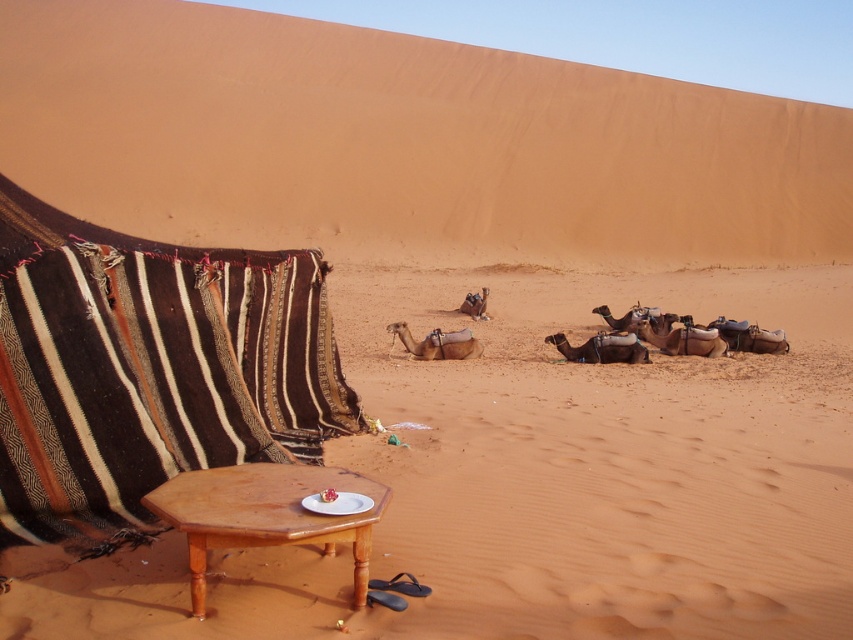
Question: Among these objects, which one is nearest to the camera?

Choices:
 (A) sandy yellow sand at center
 (B) brown wooden table at lower center
 (C) brown striped fabric at left

Answer: (B)

Question: Can you confirm if sandy yellow sand at center is positioned above brown striped fabric at left?

Choices:
 (A) no
 (B) yes

Answer: (A)

Question: Is sandy yellow sand at center positioned in front of brown wooden table at lower center?

Choices:
 (A) yes
 (B) no

Answer: (B)

Question: Does sandy yellow sand at center come in front of brown striped fabric at left?

Choices:
 (A) yes
 (B) no

Answer: (A)

Question: Which object is positioned farthest from the sandy yellow sand at center?

Choices:
 (A) brown striped fabric at left
 (B) brown wooden table at lower center
 (C) smooth sand dune at upper left

Answer: (C)

Question: Which object is closer to the camera taking this photo?

Choices:
 (A) brown wooden table at lower center
 (B) smooth sand dune at upper left
 (C) brown striped fabric at left

Answer: (A)